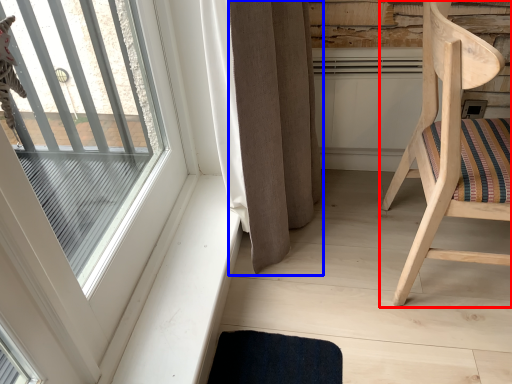
Question: Which object appears farthest to the camera in this image, chair (highlighted by a red box) or curtain (highlighted by a blue box)?

Choices:
 (A) chair
 (B) curtain

Answer: (B)